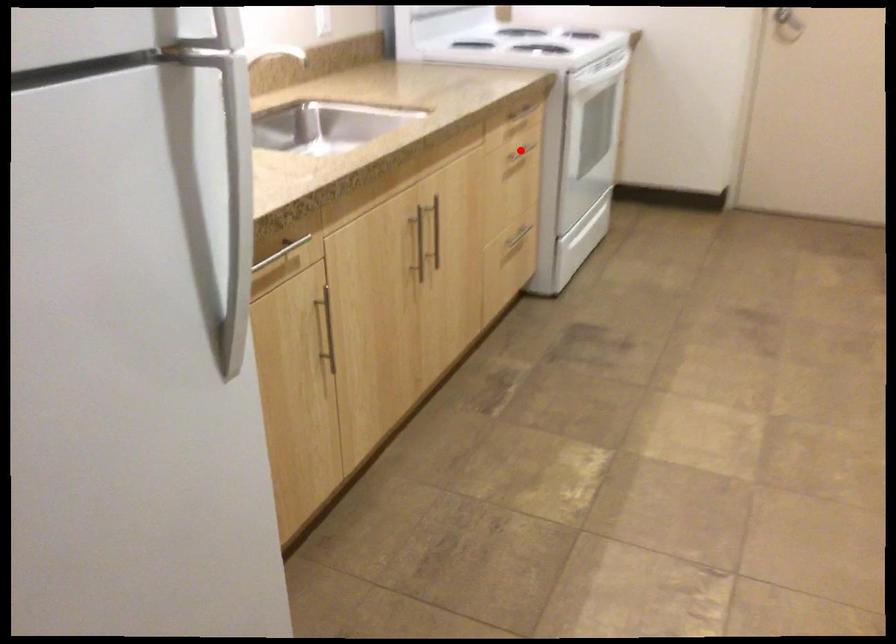
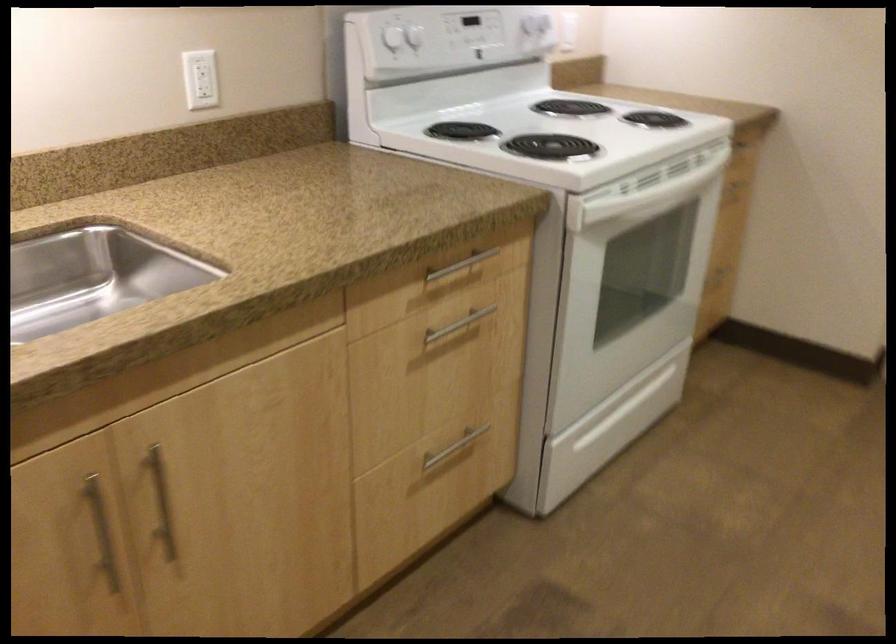
Question: I am providing you with two images of the same scene from different viewpoints. A red point is shown in image1. For the corresponding object point in image2, is it positioned nearer or farther from the camera?

Choices:
 (A) Nearer
 (B) Farther

Answer: (A)